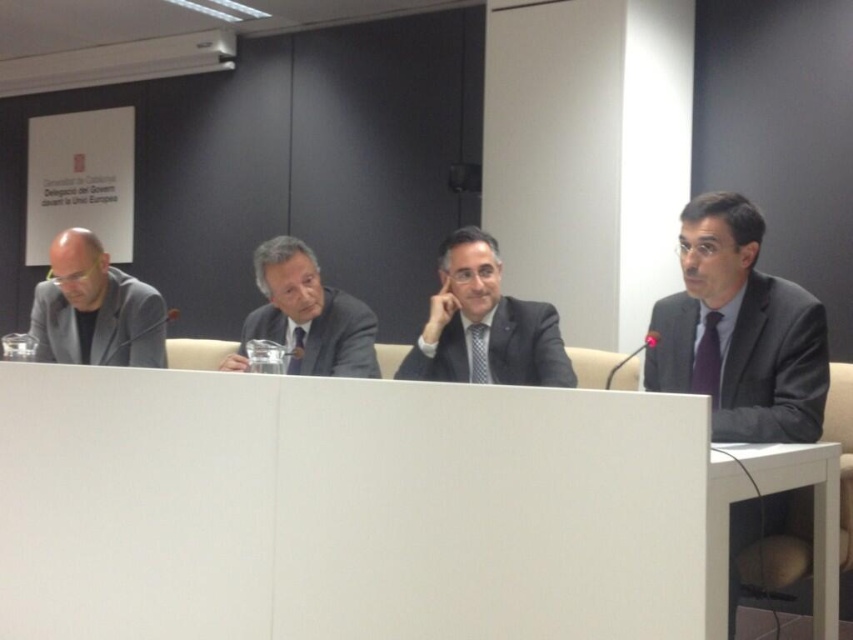
You are sitting at the conference table and need to pass a document to the person wearing the dark gray suit at center. Which direction should you move relative to the white glossy table at lower right to reach them?

To reach the person wearing the dark gray suit at center, you should move to the left of the white glossy table at lower right since the dark gray suit at center is located to the left of the table.